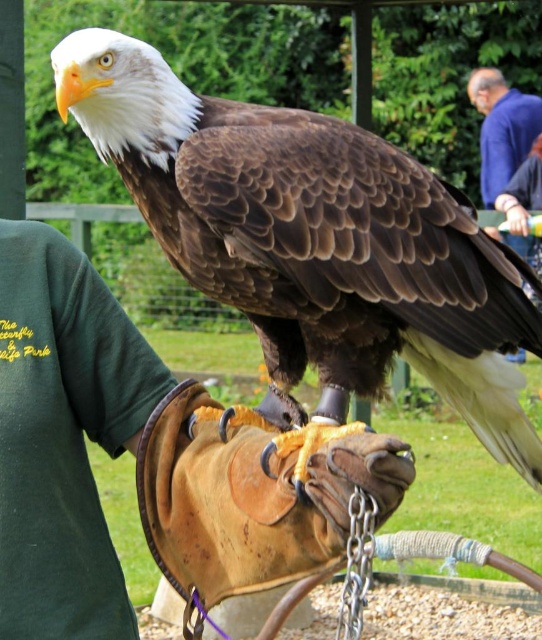
You are a photographer trying to capture the bald eagle on the matte black glove at upper right. You notice the green fabric arm at upper right is blocking part of the view. Based on their positions, which object should you move to get a clearer shot of the eagle?

The green fabric arm at upper right is much taller than the matte black glove at upper right, so moving the green fabric arm at upper right would allow you to see the eagle more clearly.

You are a photographer aiming to capture the bald eagle on the gloved hand. You notice a green fabric arm at upper right at point [521,195]. Will this arm obstruct your view of the eagle?

The green fabric arm at upper right at point [521,195] is located at the upper right, so it may obstruct the view of the bald eagle on the gloved hand depending on the camera angle and positioning.

You are a researcher studying the positioning of animals in photographs. In the image provided, where is the brown feathered eagle at center positioned relative to the center of the image? Please provide coordinates if available.

The brown feathered eagle at center is located at coordinates point (313, 241), which is slightly to the left and above the exact center of the image.